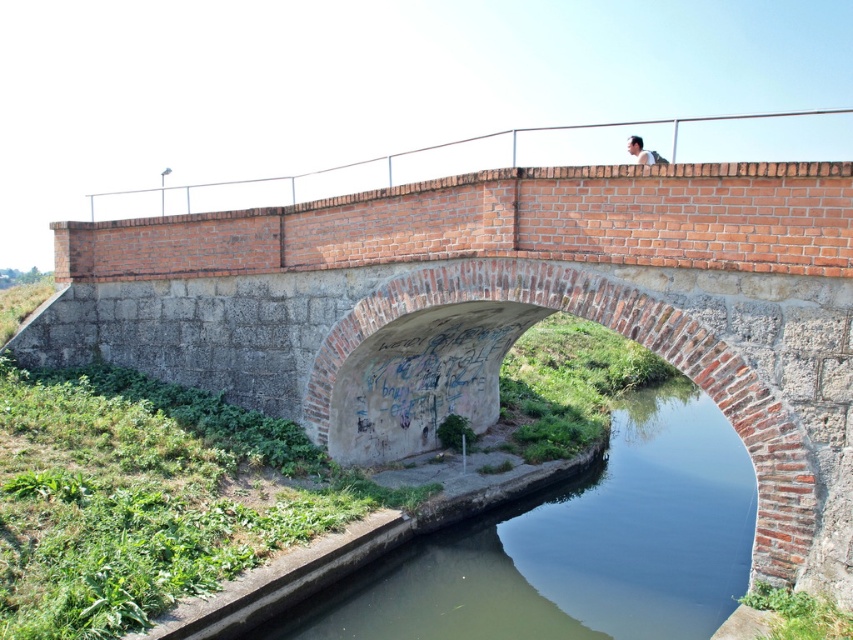
You are a maintenance worker checking the bridge structure. You notice the green concrete river at center and the white metal rail at upper center. Which object is taller? Please answer based on their positions in the image.

The white metal rail at upper center is taller than the green concrete river at center.

You are standing on the brick bridge and want to locate the green concrete river at center. According to the coordinates provided, where should you look relative to your position?

The green concrete river at center is located at coordinates point (575, 547), so you should look towards the lower right direction from your current position on the bridge.